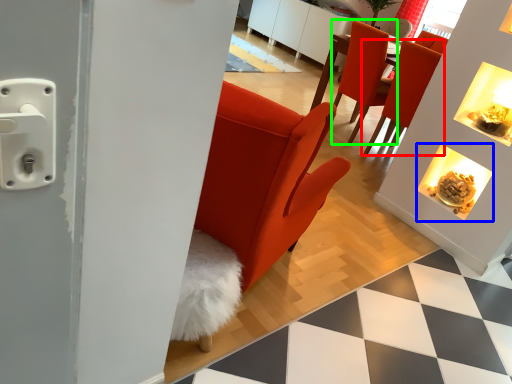
Question: Considering the real-world distances, which object is closest to chair (highlighted by a red box)? fireplace (highlighted by a blue box) or chair (highlighted by a green box).

Choices:
 (A) fireplace
 (B) chair

Answer: (B)